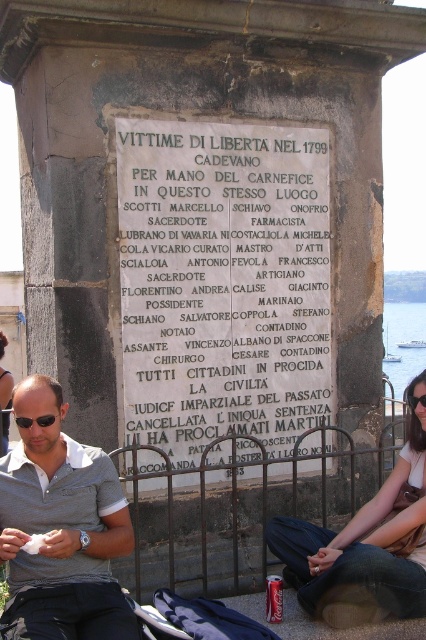
You are a photographer trying to capture both the denim jeans at lower right and the black plastic sunglasses at lower left in a single frame. Which object should you focus on first to ensure both are in the frame without moving the camera?

The denim jeans at lower right is larger in size compared to the black plastic sunglasses at lower left, so you should focus on the denim jeans at lower right first to ensure both objects are in the frame without moving the camera.